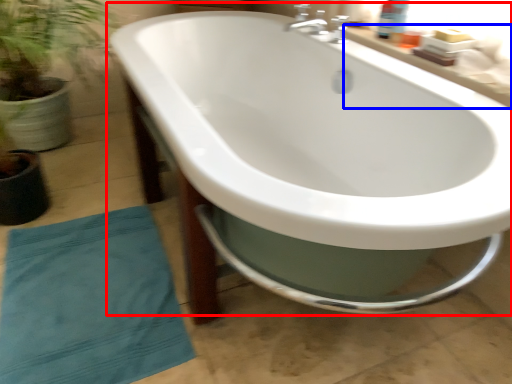
Question: Among these objects, which one is nearest to the camera, bathtub (highlighted by a red box) or counter top (highlighted by a blue box)?

Choices:
 (A) bathtub
 (B) counter top

Answer: (A)